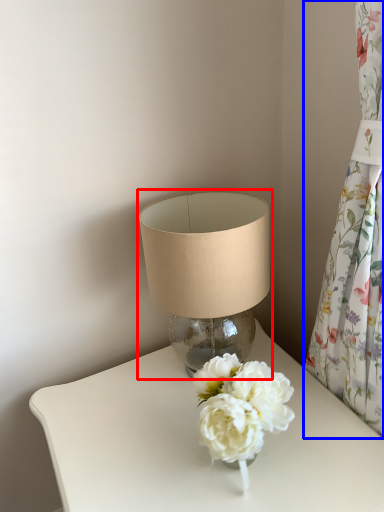
Question: Among these objects, which one is nearest to the camera, lamp (highlighted by a red box) or curtain (highlighted by a blue box)?

Choices:
 (A) lamp
 (B) curtain

Answer: (B)